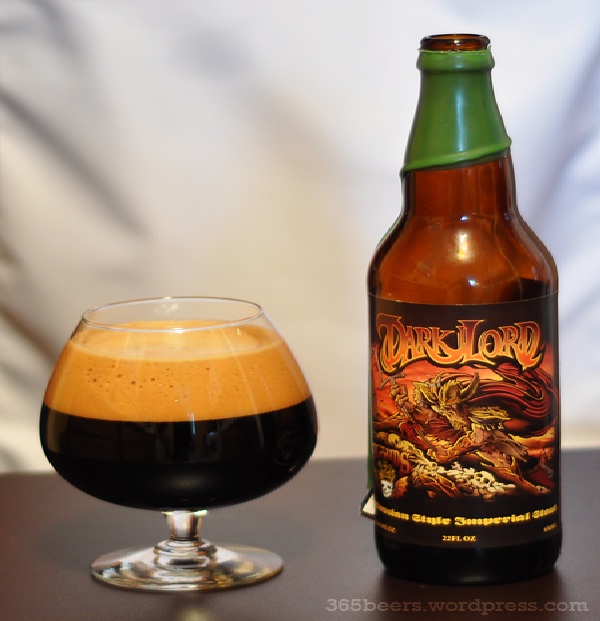
Find the location of a particular element. foam is located at coordinates (169, 394).